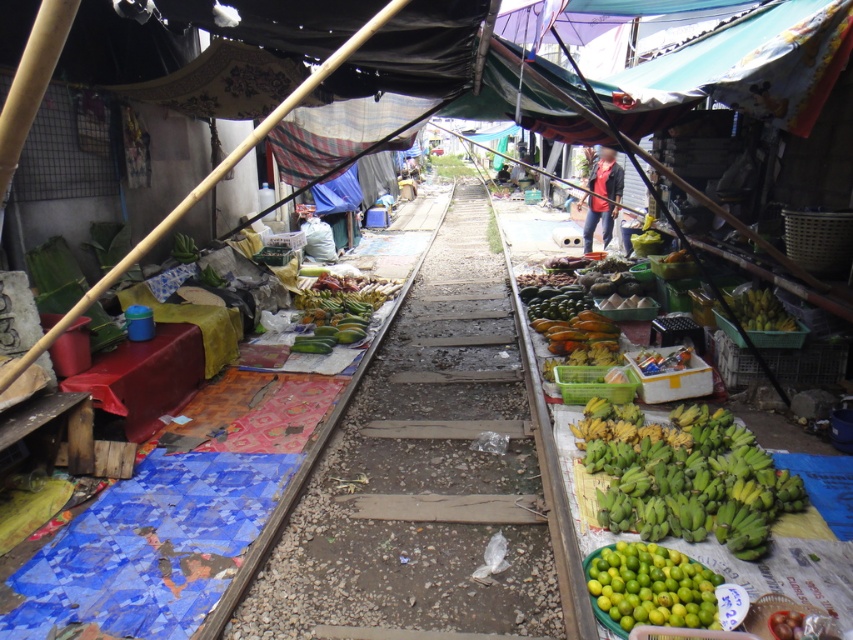
Does brown wooden train track at center appear over green matte bananas at center-right?

Actually, brown wooden train track at center is below green matte bananas at center-right.

Does point (412, 364) come farther from viewer compared to point (753, 310)?

That is True.

Find the location of `brown wooden train track at center`. brown wooden train track at center is located at coordinates (432, 474).

Is green matte bananas at right in front of green fabric vendor at center?

That is True.

Where is `green matte bananas at right`? green matte bananas at right is located at coordinates (682, 480).

In order to click on green matte bananas at right in this screenshot , I will do `click(682, 480)`.

Can you confirm if green matte bananas at center-right is shorter than green matte bananas at left?

Incorrect, green matte bananas at center-right's height does not fall short of green matte bananas at left's.

This screenshot has height=640, width=853. What do you see at coordinates (759, 310) in the screenshot?
I see `green matte bananas at center-right` at bounding box center [759, 310].

I want to click on green matte bananas at center-right, so click(x=759, y=310).